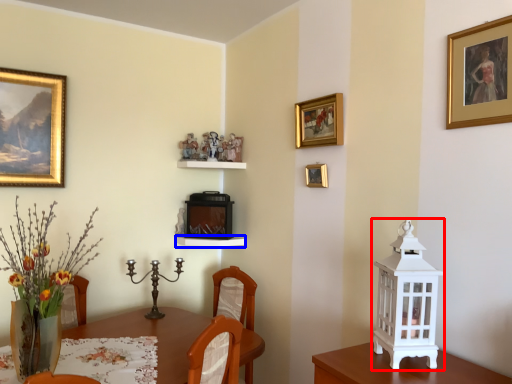
Question: Which object appears farthest to the camera in this image, candle holder (highlighted by a red box) or shelf (highlighted by a blue box)?

Choices:
 (A) candle holder
 (B) shelf

Answer: (B)